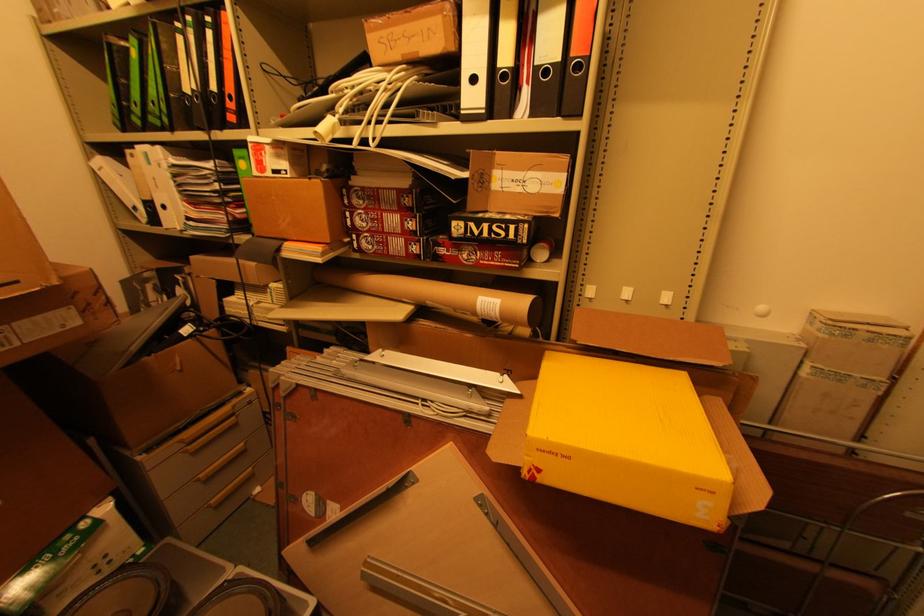
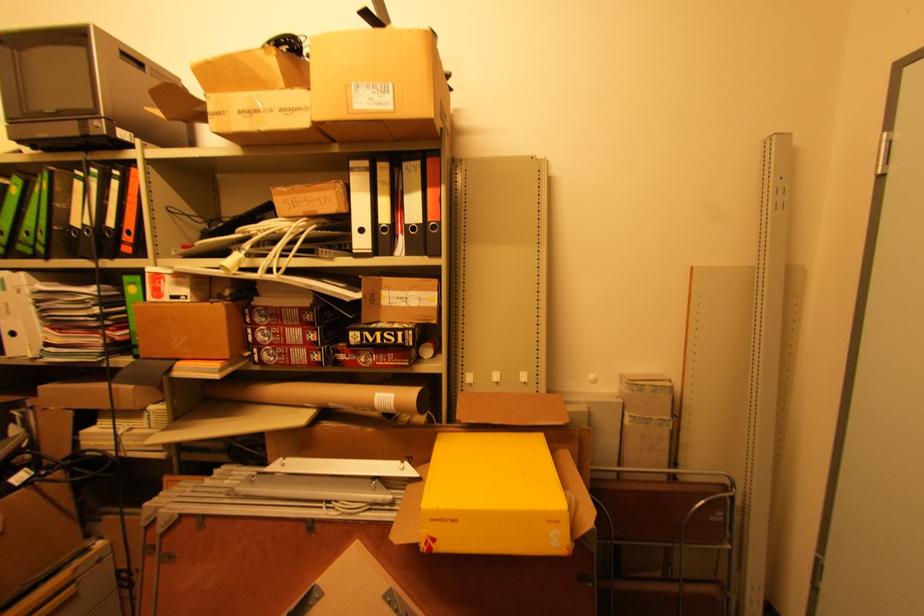
Where in the second image is the point corresponding to the point at 496,315 from the first image?

(392, 408)